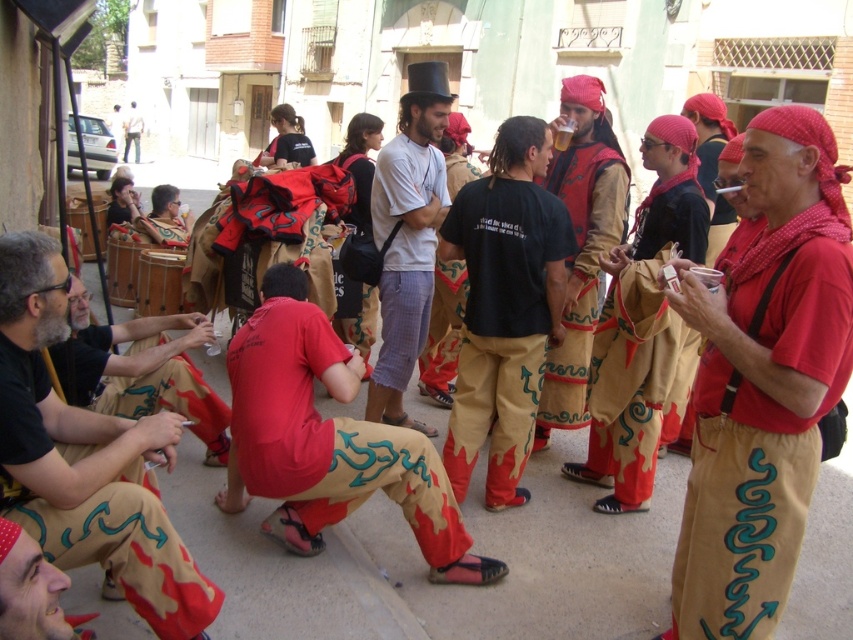
Question: Considering the relative positions of red cotton pants at center and white cotton shirt at center in the image provided, where is red cotton pants at center located with respect to white cotton shirt at center?

Choices:
 (A) below
 (B) above

Answer: (A)

Question: Estimate the real-world distances between objects in this image. Which object is farther from the matte red vest at center?

Choices:
 (A) white cotton shirt at center
 (B) matte khaki pants at lower left

Answer: (B)

Question: Which point is farther from the camera taking this photo?

Choices:
 (A) (83, 385)
 (B) (465, 433)

Answer: (B)

Question: Does black cotton t-shirt at center appear on the left side of matte red vest at center?

Choices:
 (A) no
 (B) yes

Answer: (B)

Question: Is the position of red cotton headscarf at center more distant than that of matte red shirt at lower left?

Choices:
 (A) yes
 (B) no

Answer: (B)

Question: Which object is positioned farthest from the matte red shirt at lower left?

Choices:
 (A) white cotton shirt at center
 (B) matte black sunglasses at upper left
 (C) matte khaki pants at lower left

Answer: (B)